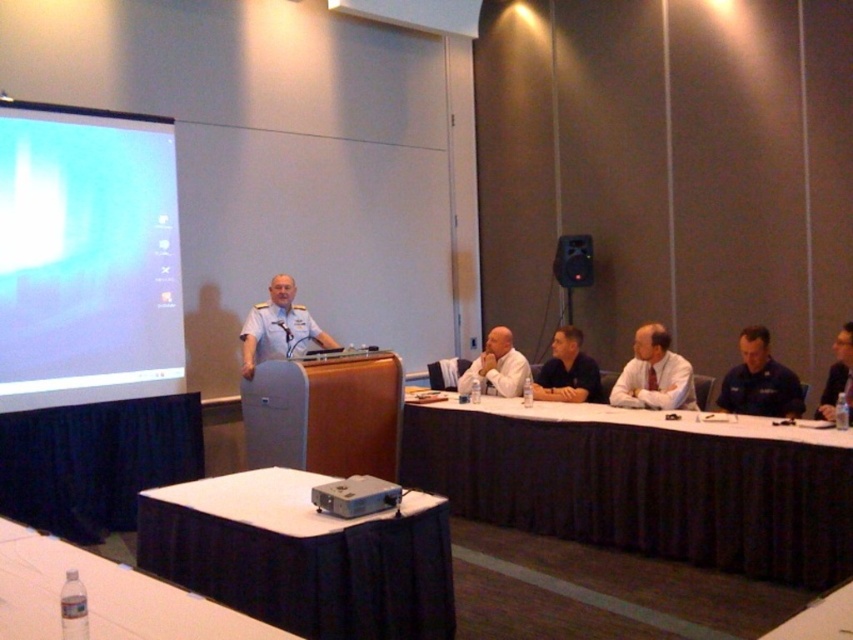
Is clear plastic bottle at lower left closer to the viewer compared to white uniform at center?

Yes, clear plastic bottle at lower left is in front of white uniform at center.

Can you confirm if clear plastic bottle at lower left is shorter than white uniform at center?

Indeed, clear plastic bottle at lower left has a lesser height compared to white uniform at center.

Who is more distant from viewer, (x=30, y=561) or (x=270, y=317)?

The point (x=270, y=317) is more distant.

Locate an element on the screen. clear plastic bottle at lower left is located at coordinates (103, 596).

Looking at this image, does white matte projection screen at upper left have a lesser height compared to blue uniform at right?

In fact, white matte projection screen at upper left may be taller than blue uniform at right.

Describe the element at coordinates (86, 257) in the screenshot. The image size is (853, 640). I see `white matte projection screen at upper left` at that location.

Identify the location of white matte projection screen at upper left. The width and height of the screenshot is (853, 640). (86, 257).

This screenshot has height=640, width=853. Describe the element at coordinates (86, 257) in the screenshot. I see `white matte projection screen at upper left` at that location.

Is white matte projection screen at upper left above white uniform at center?

Correct, white matte projection screen at upper left is located above white uniform at center.

Who is more forward, (74, 353) or (248, 342)?

Point (74, 353) is in front.

This screenshot has width=853, height=640. I want to click on white matte projection screen at upper left, so click(x=86, y=257).